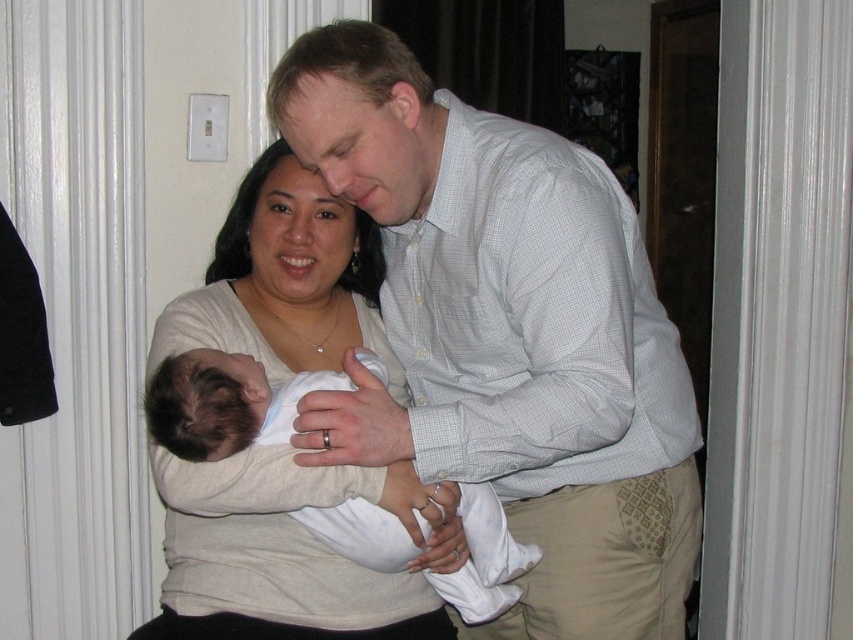
You are a photographer setting up a photo shoot for a family portrait. You need to ensure that all subjects are visible in the frame. Given the positions of the light blue checkered shirt at center and the white soft fabric newborn at center, which subject should you focus on first to ensure proper framing?

The light blue checkered shirt at center is much taller than the white soft fabric newborn at center, so you should focus on the light blue checkered shirt at center first to ensure proper framing for the taller subject.

You are standing in the room and want to reach both points, point (310, 129) and point (350, 528). Which point should you go to first if you want to reach the one closer to you first?

You should go to point (310, 129) first because it is closer to you than point (350, 528).

You are a photographer trying to capture a closeup shot of both the light blue checkered shirt at center and the light beige sweater at center. Given that your camera lens has a maximum focus range of 8 inches, will you be able to capture both items in focus without adjusting their positions?

The light blue checkered shirt at center and light beige sweater at center are 8.47 inches apart from each other. Since the distance between them exceeds the camera lens maximum focus range of 8 inches, you will need to adjust their positions to be closer together to ensure both are in focus.